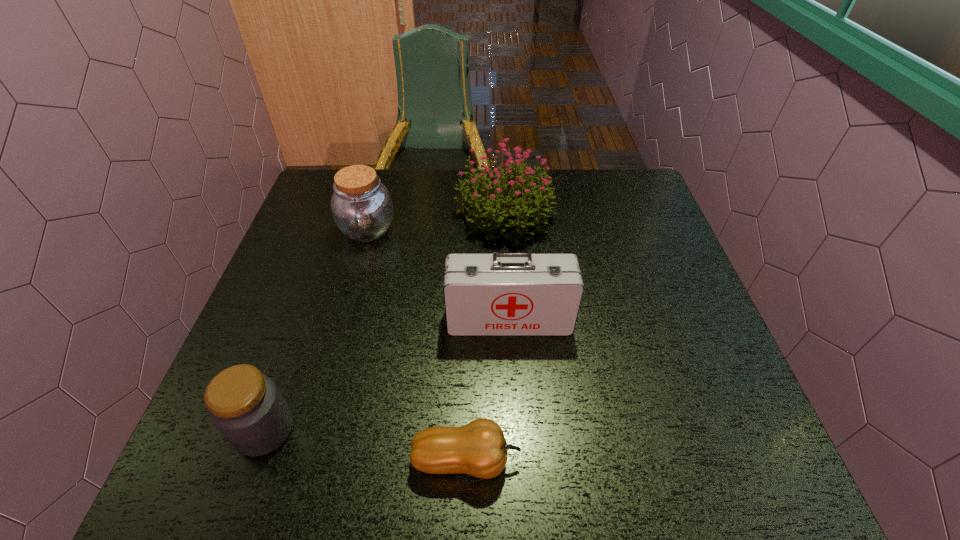
This screenshot has width=960, height=540. Find the location of `the tallest object`. the tallest object is located at coordinates (487, 205).

Where is `the farther jar`? the farther jar is located at coordinates (362, 208).

What are the coordinates of `the first-aid kit` in the screenshot? It's located at (502, 293).

You are a GUI agent. You are given a task and a screenshot of the screen. Output one action in this format:
    pyautogui.click(x=<x>, y=<y>)
    Task: Click on the nearer jar
    This screenshot has width=960, height=540.
    Given the screenshot: What is the action you would take?
    [x=245, y=405]

Image resolution: width=960 pixels, height=540 pixels. Identify the location of gourd. (479, 449).

I want to click on free location located 0.300m on the left of the bouquet, so click(350, 214).

You are a GUI agent. You are given a task and a screenshot of the screen. Output one action in this format:
    pyautogui.click(x=<x>, y=<y>)
    Task: Click on the blank space located 0.320m on the right of the farther jar
    Image resolution: width=960 pixels, height=540 pixels.
    Given the screenshot: What is the action you would take?
    pyautogui.click(x=512, y=230)

Where is `vacant space located 0.110m on the front-facing side of the third farthest object`? The width and height of the screenshot is (960, 540). vacant space located 0.110m on the front-facing side of the third farthest object is located at coordinates [x=513, y=380].

Identify the location of free region located on the surface of the nearer jar near the warning symbol. (495, 429).

This screenshot has height=540, width=960. Find the location of `free region located on the stem side of the shortest object`. free region located on the stem side of the shortest object is located at coordinates (698, 460).